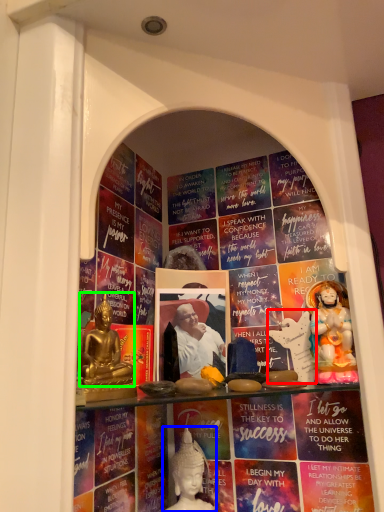
Question: Which object is positioned farthest from sculpture (highlighted by a red box)? Select from person (highlighted by a blue box) and person (highlighted by a green box).

Choices:
 (A) person
 (B) person

Answer: (B)